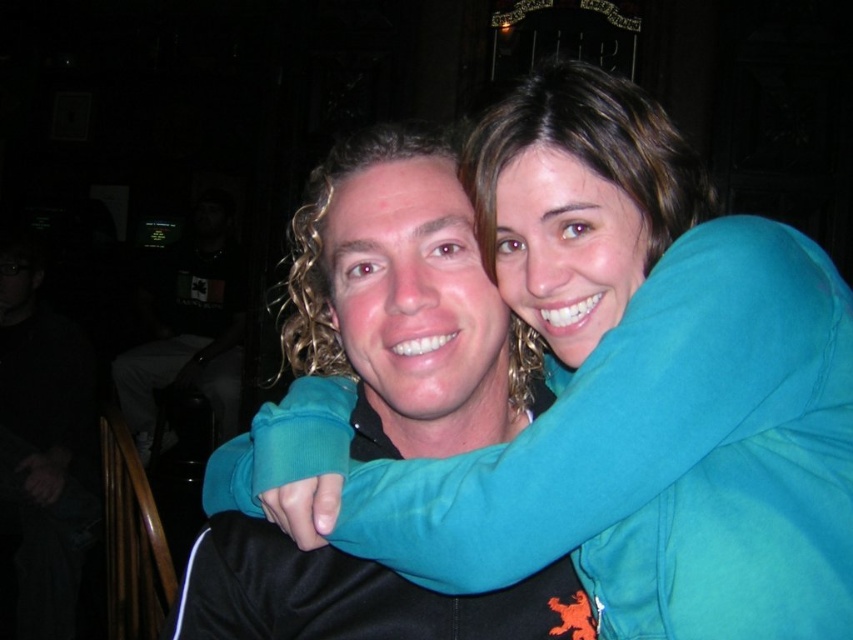
Is teal fleece jacket at center shorter than matte teal hoodie at center?

In fact, teal fleece jacket at center may be taller than matte teal hoodie at center.

Consider the image. Does teal fleece jacket at center have a greater width compared to matte teal hoodie at center?

Correct, the width of teal fleece jacket at center exceeds that of matte teal hoodie at center.

Where is `teal fleece jacket at center`? Image resolution: width=853 pixels, height=640 pixels. teal fleece jacket at center is located at coordinates (640, 390).